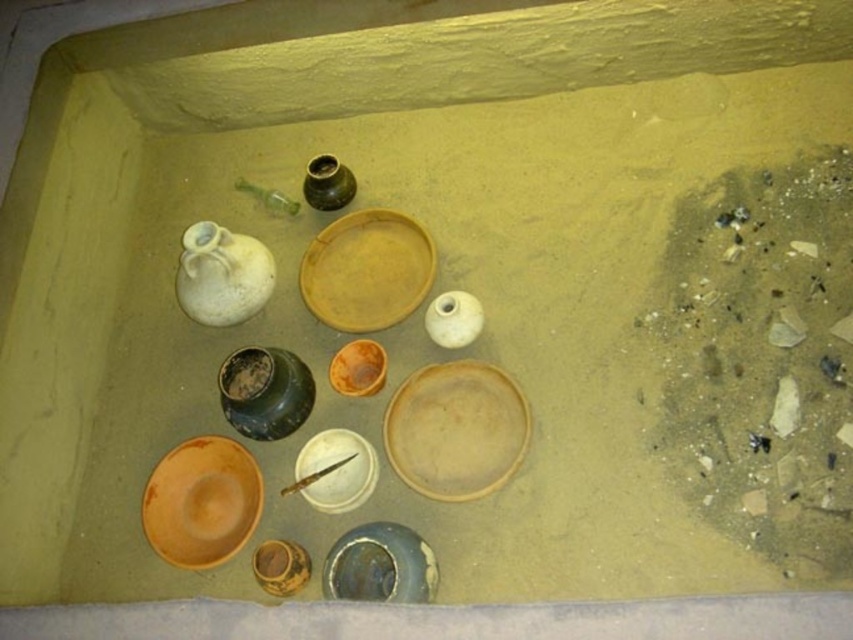
Question: Can you confirm if dark brown earthenware jar at center is wider than matte brown ceramic jar at upper center?

Choices:
 (A) yes
 (B) no

Answer: (A)

Question: Is white matte vase at center behind speckled yellow clay jar at lower center?

Choices:
 (A) no
 (B) yes

Answer: (B)

Question: Which point is closer to the camera?

Choices:
 (A) (331, 556)
 (B) (339, 200)
 (C) (364, 381)
 (D) (291, 589)

Answer: (A)

Question: Can you confirm if matte orange plate at center-left is positioned to the right of dark brown earthenware jar at center?

Choices:
 (A) yes
 (B) no

Answer: (B)

Question: Which of the following is the farthest from the observer?

Choices:
 (A) wooden knife at center
 (B) matte orange plate at center-left
 (C) matte orange bowl at center
 (D) matte clay plate at center

Answer: (C)

Question: Which object appears farthest from the camera in this image?

Choices:
 (A) speckled yellow clay jar at lower center
 (B) white matte plate at center
 (C) white matte vase at center
 (D) white matte bottle at upper left

Answer: (D)